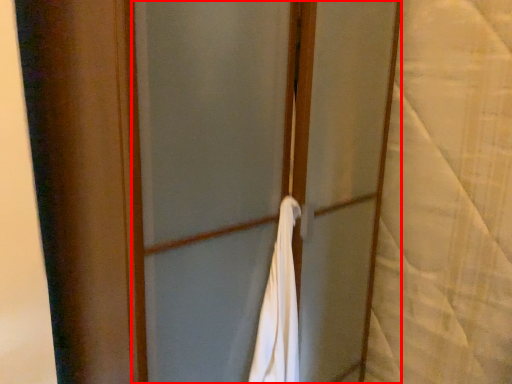
Question: From the image's perspective, where is screen door (annotated by the red box) located relative to curtain?

Choices:
 (A) below
 (B) above

Answer: (A)